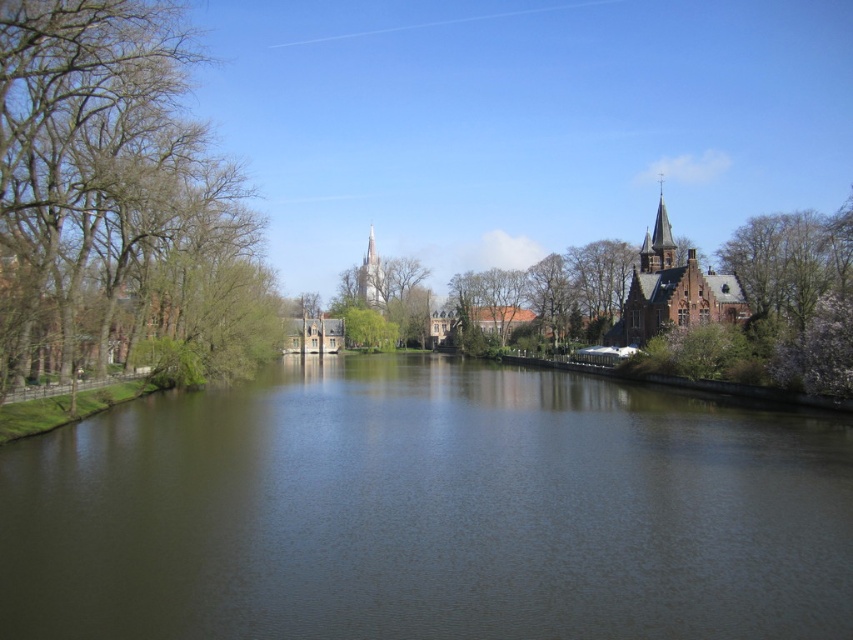
Question: Is greenish water at center to the left of cherry blossom tree at right from the viewer's perspective?

Choices:
 (A) no
 (B) yes

Answer: (B)

Question: Does brown brick church at upper right appear on the left side of white stone tower at center?

Choices:
 (A) no
 (B) yes

Answer: (A)

Question: Does greenish water at center lie behind cherry blossom tree at right?

Choices:
 (A) yes
 (B) no

Answer: (B)

Question: Among these points, which one is nearest to the camera?

Choices:
 (A) (782, 344)
 (B) (84, 298)
 (C) (682, 289)

Answer: (B)

Question: Which of the following is the farthest from the observer?

Choices:
 (A) white stone tower at center
 (B) greenish water at center
 (C) green leafy tree at left

Answer: (A)

Question: Which object is farther from the camera taking this photo?

Choices:
 (A) white stone tower at center
 (B) green leafy tree at left
 (C) greenish water at center

Answer: (A)